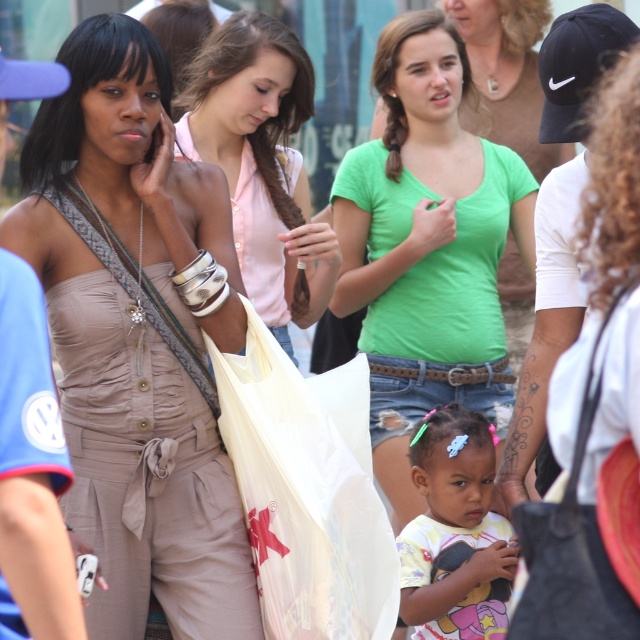
From the picture: You are organizing a clothing donation drive and need to determine which items can fit into a standard donation bin. The bin has a width limit of 20 inches. You have two items to assess from the image provided. The first is the matte beige jumpsuit at center, and the second is the green cotton shirt at center. Based on their sizes, which item is more likely to fit within the bin without exceeding the width limit?

The matte beige jumpsuit at center is thinner than the green cotton shirt at center, so the matte beige jumpsuit at center is more likely to fit within the bin without exceeding the width limit.

You are a photographer trying to capture a candid shot of two people in the center of the scene. The subjects are wearing a matte beige jumpsuit at center and a green cotton shirt at center. Which one should you focus on first to ensure they are in sharp focus?

The matte beige jumpsuit at center is closer to the viewer than the green cotton shirt at center, so you should focus on the matte beige jumpsuit at center first to ensure sharpness.

You are a photographer at the event and want to capture a clear shot of the white plastic bag at center without the matte beige jumpsuit at center blocking it. What adjustment should you make to your camera angle?

The white plastic bag at center is behind the matte beige jumpsuit at center, so to avoid blocking, move the camera angle forward to focus directly on the white plastic bag at center beyond the jumpsuit.